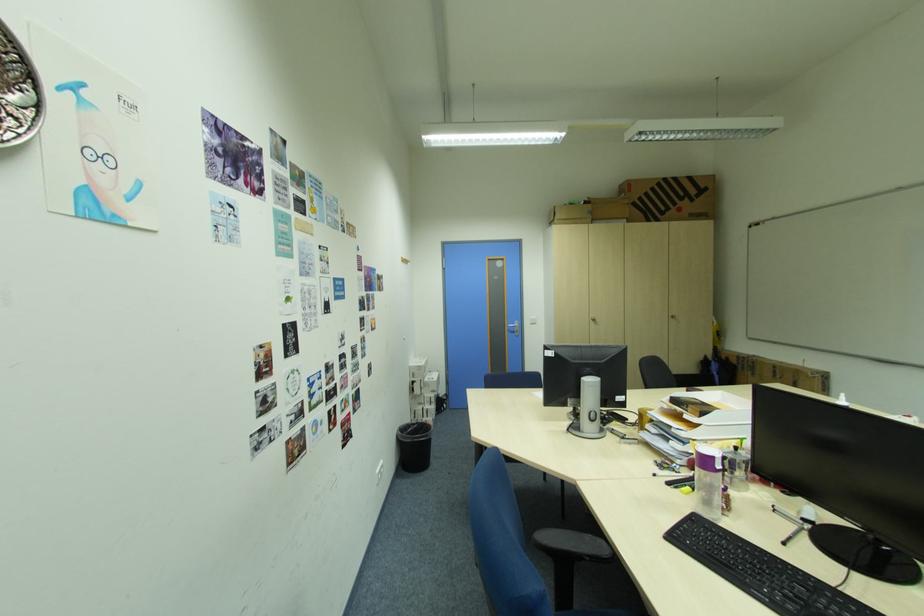
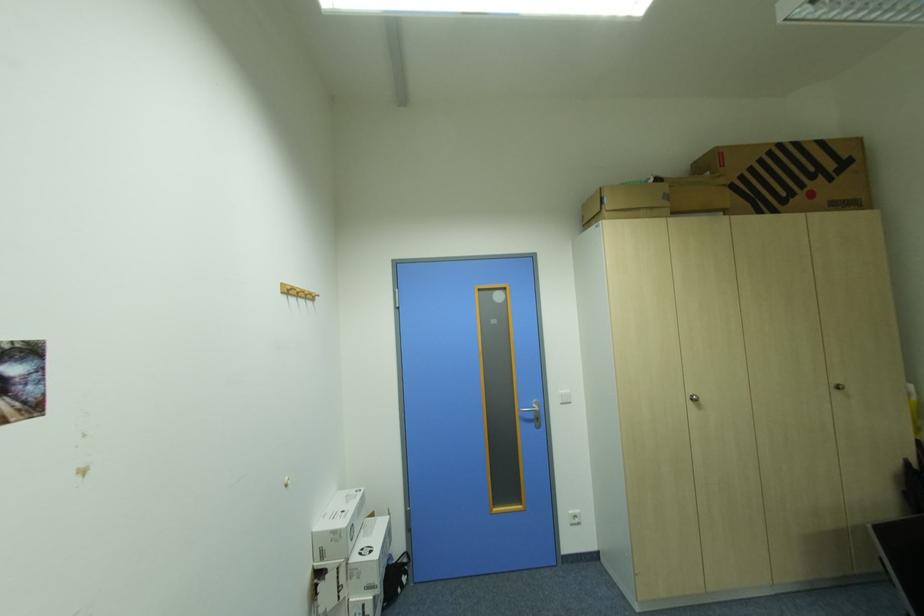
Where in the second image is the point corresponding to the point at 678,317 from the first image?

(840, 386)